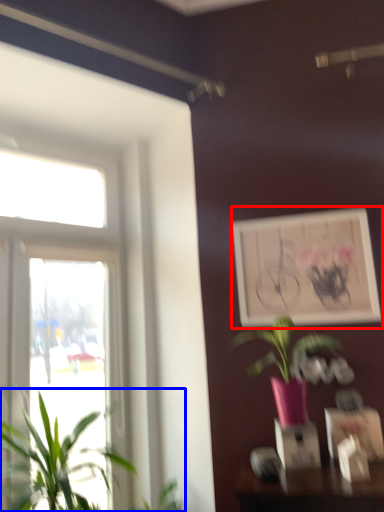
Question: Which point is further to the camera, picture frame (highlighted by a red box) or houseplant (highlighted by a blue box)?

Choices:
 (A) picture frame
 (B) houseplant

Answer: (A)